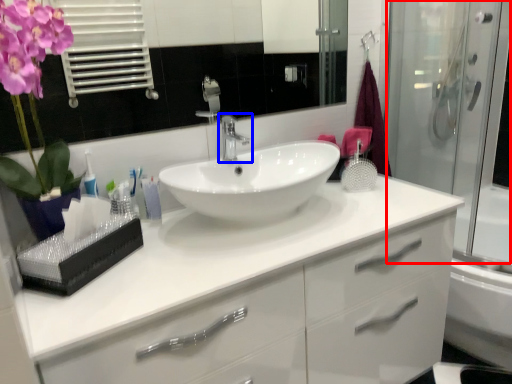
Question: Which object is closer to the camera taking this photo, screen door (highlighted by a red box) or tap (highlighted by a blue box)?

Choices:
 (A) screen door
 (B) tap

Answer: (A)